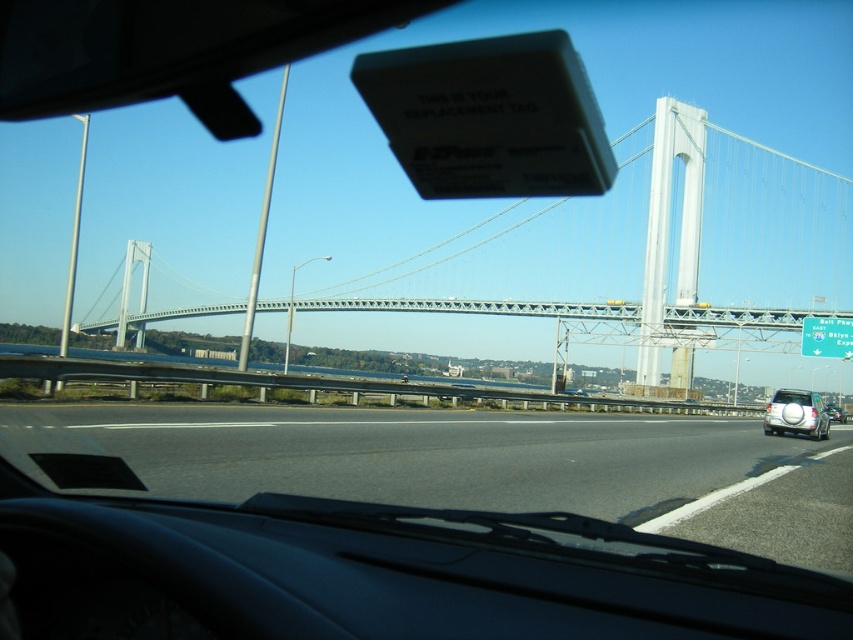
Between point (512, 440) and point (694, 241), which one is positioned in front?

Positioned in front is point (512, 440).

Who is positioned more to the left, black asphalt highway at center or white metallic suspension bridge at center?

black asphalt highway at center is more to the left.

I want to click on black asphalt highway at center, so [480, 465].

Identify the location of black asphalt highway at center. This screenshot has height=640, width=853. (480, 465).

Does black asphalt highway at center come in front of white matte suv at right?

Yes.

Does point (448, 435) lie behind point (766, 426)?

That is False.

Where is `black asphalt highway at center`? This screenshot has height=640, width=853. black asphalt highway at center is located at coordinates (480, 465).

Can you confirm if white metallic suspension bridge at center is smaller than white matte suv at right?

No.

Which is more to the right, white metallic suspension bridge at center or white matte suv at right?

From the viewer's perspective, white metallic suspension bridge at center appears more on the right side.

Is point (781, 324) farther from viewer compared to point (791, 403)?

Yes, point (781, 324) is farther from viewer.

In order to click on white metallic suspension bridge at center in this screenshot , I will do `click(647, 248)`.